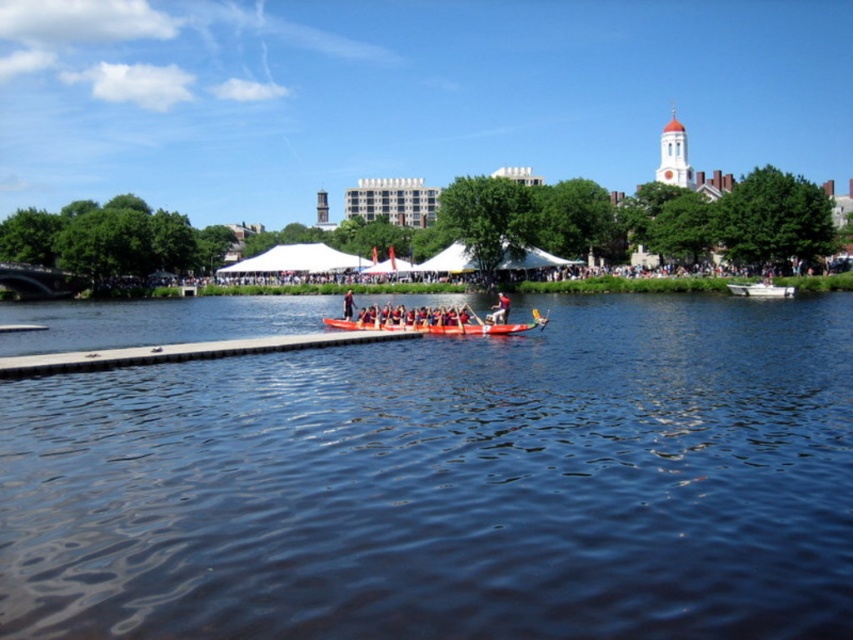
Consider the image. You are a photographer standing on the dock and want to capture both the smooth red boat at center and the red fabric person at center in a single wide shot. Based on their sizes, do you think you can fit both into the frame without zooming in?

The smooth red boat at center is wider than the red fabric person at center, so yes, you can fit both into the frame without zooming in because the boat is larger and likely occupies more space, allowing the person to be included as well.

You are a photographer standing on the dock. You want to take a photo of the smooth red boat at center and the red fabric person at center. Which one should you focus on first if you want to capture both in the same frame without moving the camera?

The smooth red boat at center is below the red fabric person at center, so you should focus on the red fabric person at center first to ensure both are in the frame.

You are a photographer trying to capture the smooth red boat at center and the red fabric person at center in the same frame. Based on their sizes in the image, which one should you focus on first to ensure both are in focus?

The smooth red boat at center has a smaller size compared to red fabric person at center, so you should focus on the red fabric person at center first since it is larger and will be easier to capture clearly in the frame.